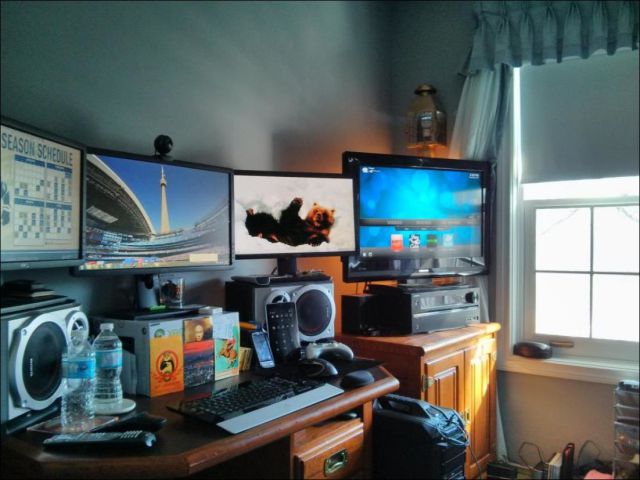
Identify the location of webcam. This screenshot has width=640, height=480. (166, 142).